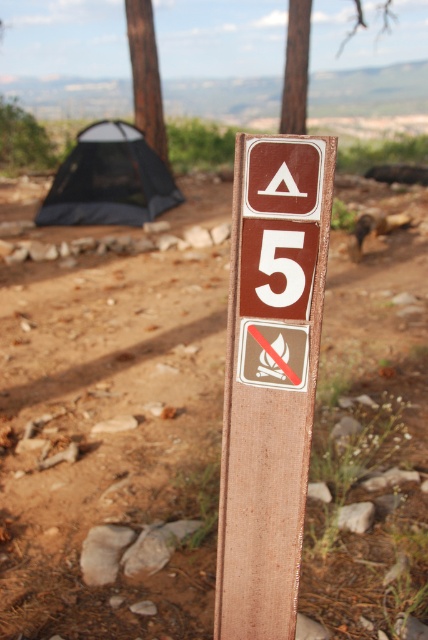
Question: Which point is closer to the camera?

Choices:
 (A) brown wood pole at upper center
 (B) brown rough wood tree at upper left
 (C) brown wooden sign at center

Answer: (C)

Question: Is black mesh tent at left wider than brown wood pole at upper center?

Choices:
 (A) yes
 (B) no

Answer: (B)

Question: Does brown wooden sign at center appear over brown rough wood tree at upper left?

Choices:
 (A) yes
 (B) no

Answer: (B)

Question: Which object is the closest to the brown dirt track at center?

Choices:
 (A) brown wood pole at upper center
 (B) brown rough wood tree at upper left
 (C) brown wooden sign at center

Answer: (C)

Question: Which of the following is the closest to the observer?

Choices:
 (A) pos(234,378)
 (B) pos(140,120)
 (C) pos(65,216)
 (D) pos(288,49)

Answer: (A)

Question: Does brown dirt track at center come behind black mesh tent at left?

Choices:
 (A) yes
 (B) no

Answer: (B)